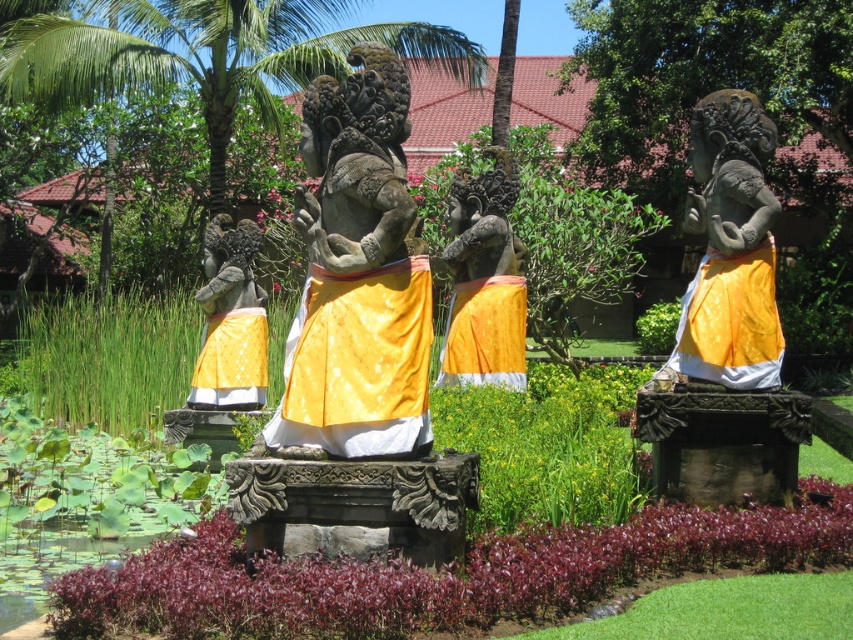
Question: Which point is closer to the camera taking this photo?

Choices:
 (A) (358, 285)
 (B) (221, 371)
 (C) (517, 250)
 (D) (349, 284)

Answer: (A)

Question: Is shiny yellow fabric skirt at center to the right of matte yellow fabric statue at left from the viewer's perspective?

Choices:
 (A) no
 (B) yes

Answer: (B)

Question: Can you confirm if polished stone statue at center is smaller than matte stone statue at right?

Choices:
 (A) no
 (B) yes

Answer: (B)

Question: Considering the real-world distances, which object is closest to the shiny gold statue at center?

Choices:
 (A) matte yellow fabric statue at left
 (B) shiny yellow fabric skirt at center
 (C) matte stone statue at center

Answer: (B)

Question: Among these objects, which one is nearest to the camera?

Choices:
 (A) shiny yellow fabric skirt at center
 (B) polished stone statue at center
 (C) matte stone statue at center

Answer: (B)

Question: Can you confirm if matte stone statue at center is positioned to the left of matte yellow fabric statue at left?

Choices:
 (A) yes
 (B) no

Answer: (B)